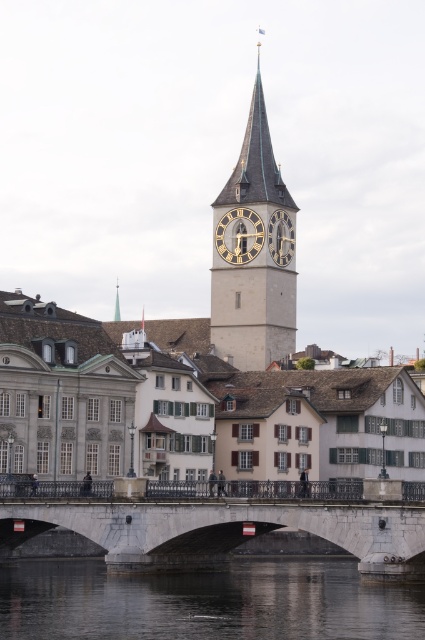
Question: Which object is farther from the camera taking this photo?

Choices:
 (A) gold/brass/golden clock at center
 (B) green glass spire at upper center

Answer: (B)

Question: Considering the real-world distances, which object is closest to the gold/brass/golden clock at center?

Choices:
 (A) smooth gray stone clock tower at center
 (B) white stone bridge at center
 (C) white painted wood building at center

Answer: (A)

Question: Can you confirm if gold/brass/golden clock at center is wider than green glass spire at upper center?

Choices:
 (A) yes
 (B) no

Answer: (B)

Question: Which object is positioned farthest from the gold/brass/golden clock at center?

Choices:
 (A) transparent water at center
 (B) green glass spire at upper center
 (C) white painted wood building at center
 (D) gold metallic clock at center

Answer: (B)

Question: Does transparent water at center appear on the left side of gold metallic clock at center?

Choices:
 (A) yes
 (B) no

Answer: (A)

Question: From the image, what is the correct spatial relationship of white painted wood building at center in relation to smooth gray stone clock tower at center?

Choices:
 (A) above
 (B) below

Answer: (B)